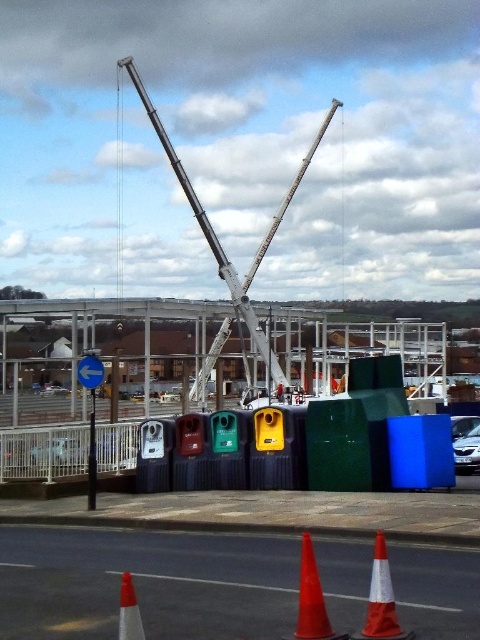
Between white metallic crane at center and orange matte traffic cone at lower center, which one is positioned higher?

Positioned higher is white metallic crane at center.

Locate an element on the screen. Image resolution: width=480 pixels, height=640 pixels. white metallic crane at center is located at coordinates (214, 230).

Is orange matte traffic cone at lower center to the left of orange reflective cone at lower left from the viewer's perspective?

In fact, orange matte traffic cone at lower center is to the right of orange reflective cone at lower left.

Is point (301, 564) more distant than point (132, 627)?

Yes.

Does point (298, 618) come in front of point (121, 600)?

No, it is not.

Locate an element on the screen. This screenshot has width=480, height=640. orange matte traffic cone at lower center is located at coordinates (312, 598).

Can you confirm if matte plastic recycling bins at center is wider than orange reflective cone at lower left?

Indeed, matte plastic recycling bins at center has a greater width compared to orange reflective cone at lower left.

The width and height of the screenshot is (480, 640). Identify the location of matte plastic recycling bins at center. (144, 584).

At what (x,y) coordinates should I click in order to perform the action: click on matte plastic recycling bins at center. Please return your answer as a coordinate pair (x, y). This screenshot has width=480, height=640. Looking at the image, I should click on (144, 584).